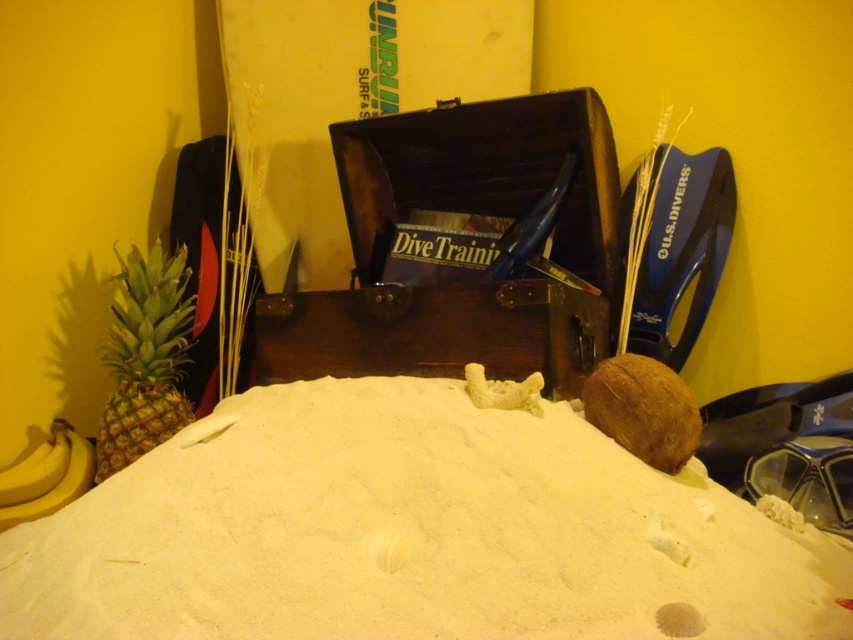
Consider the image. Does wooden chest at center have a larger size compared to yellow matte bananas at lower left?

Correct, wooden chest at center is larger in size than yellow matte bananas at lower left.

Based on the photo, who is more forward, (459, 353) or (38, 452)?

Positioned in front is point (459, 353).

You are a GUI agent. You are given a task and a screenshot of the screen. Output one action in this format:
    pyautogui.click(x=<x>, y=<y>)
    Task: Click on the wooden chest at center
    
    Given the screenshot: What is the action you would take?
    pyautogui.click(x=469, y=284)

Is white sand at center thinner than green textured pineapple at left?

Incorrect, white sand at center's width is not less than green textured pineapple at left's.

Where is `white sand at center`? white sand at center is located at coordinates (410, 532).

How distant is wooden chest at center from green textured pineapple at left?

wooden chest at center is 19.24 inches away from green textured pineapple at left.

Which of these two, wooden chest at center or green textured pineapple at left, stands shorter?

green textured pineapple at left is shorter.

Identify the location of wooden chest at center. (469, 284).